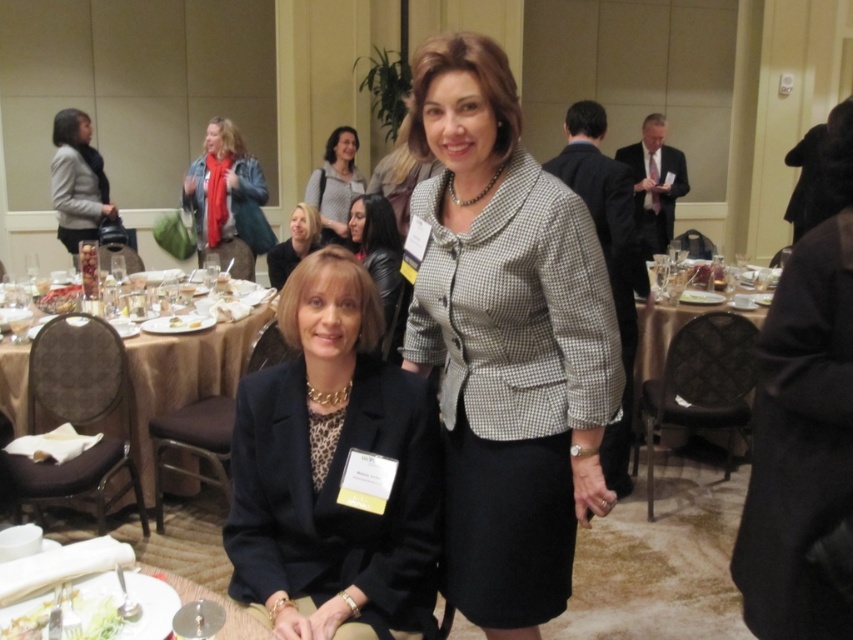
Question: Which of the following is the closest to the observer?

Choices:
 (A) gold textured table at center
 (B) leather jacket at center

Answer: (A)

Question: Which of these objects is positioned farthest from the checkered fabric blazer at center?

Choices:
 (A) matte gray blazer at left
 (B) matte black hair at upper center
 (C) translucent glass plate at lower left

Answer: (A)

Question: Which of the following is the closest to the observer?

Choices:
 (A) matte black hair at upper center
 (B) translucent glass plate at lower left
 (C) matte gray sweater at upper center

Answer: (B)

Question: Is gold fabric table at lower left above translucent glass plate at lower left?

Choices:
 (A) no
 (B) yes

Answer: (B)

Question: Does matte black blazer at center have a larger size compared to translucent glass plate at lower left?

Choices:
 (A) no
 (B) yes

Answer: (B)

Question: Can you confirm if leather jacket at center is thinner than matte gray sweater at upper center?

Choices:
 (A) no
 (B) yes

Answer: (B)